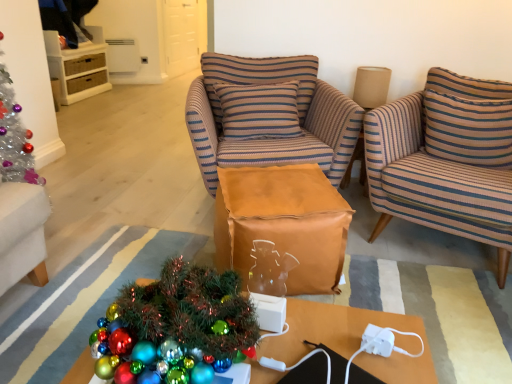
The image size is (512, 384). I want to click on free space to the left of brown striped armchair at center, the 1th chair when ordered from left to right, so click(135, 196).